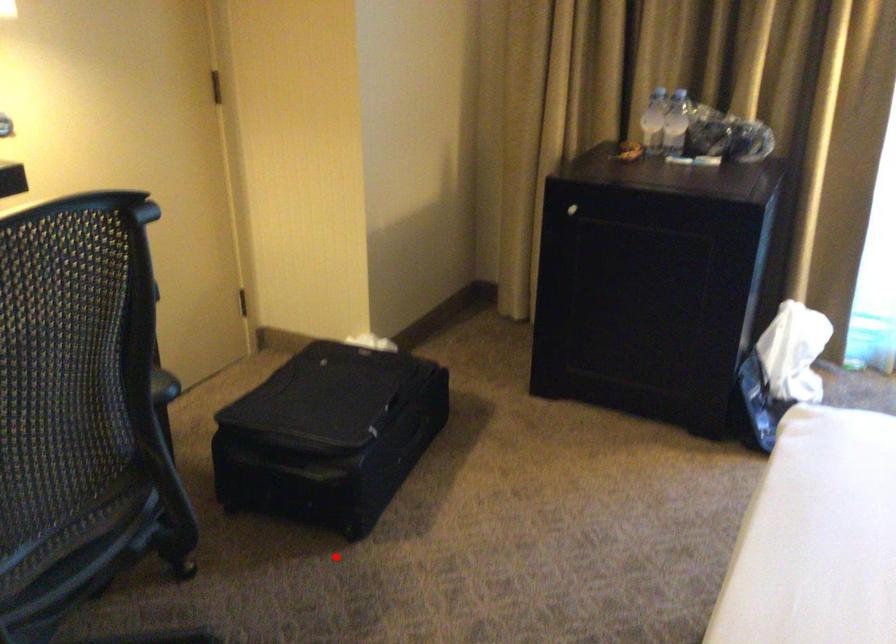
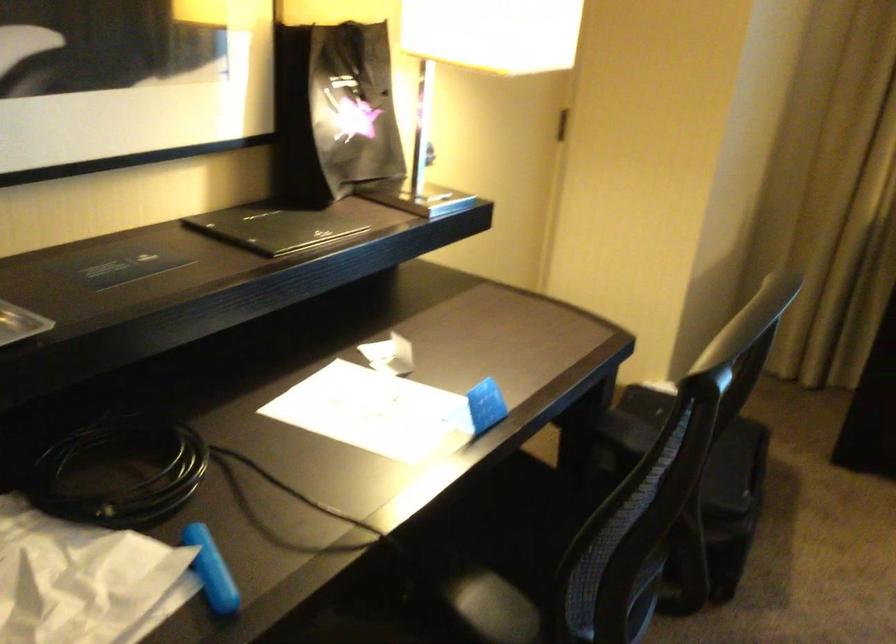
The point at the highlighted location is marked in the first image. Where is the corresponding point in the second image?

(709, 618)